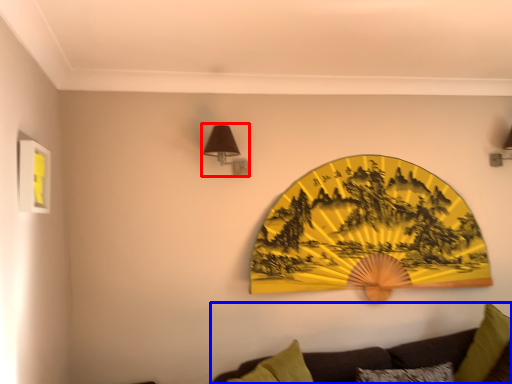
Question: Which point is closer to the camera, lamp (highlighted by a red box) or studio couch (highlighted by a blue box)?

Choices:
 (A) lamp
 (B) studio couch

Answer: (B)